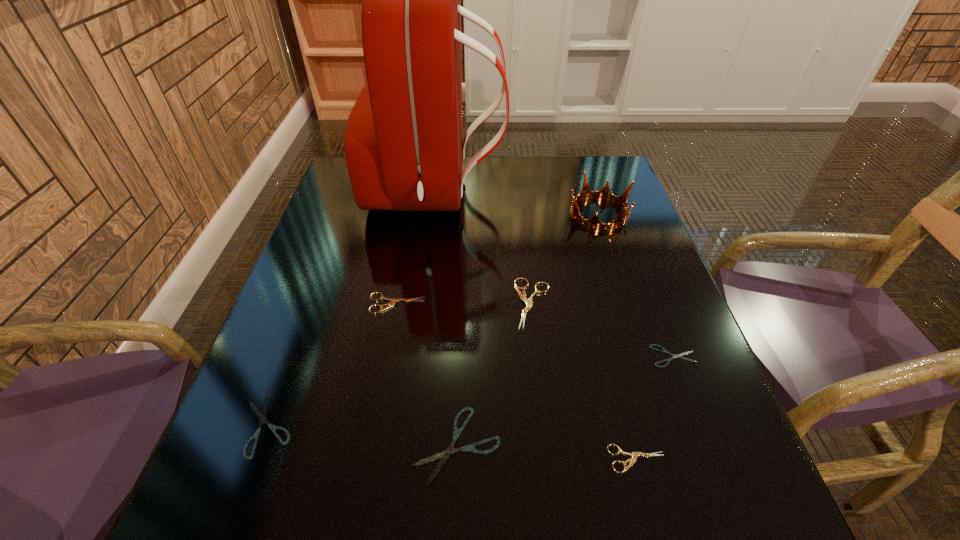
The width and height of the screenshot is (960, 540). I want to click on the fifth shears from left to right, so click(x=634, y=455).

This screenshot has height=540, width=960. I want to click on the rightmost beige shears, so click(634, 455).

Where is `the second biggest black shears`? the second biggest black shears is located at coordinates (262, 416).

The height and width of the screenshot is (540, 960). Identify the location of the leftmost shears. (262, 416).

At what (x,y) coordinates should I click in order to perform the action: click on the rightmost shears. Please return your answer as a coordinate pair (x, y). Looking at the image, I should click on tap(663, 350).

This screenshot has height=540, width=960. What are the coordinates of `the rightmost black shears` in the screenshot? It's located at (663, 350).

In order to click on blank space located on the strap side of the tallest object in this screenshot , I will do `click(520, 191)`.

What are the coordinates of `free space located 0.110m on the left of the crown` in the screenshot? It's located at 526,213.

Where is `vacant space located 0.160m on the front of the tallest shears`? The width and height of the screenshot is (960, 540). vacant space located 0.160m on the front of the tallest shears is located at coordinates (544, 400).

Identify the location of vacant region located on the front of the leftmost beige shears. (372, 435).